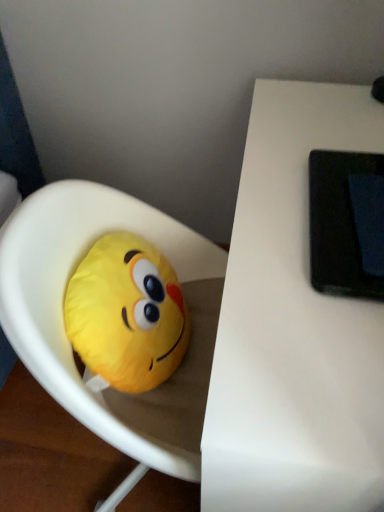
Question: From a real-world perspective, is yellow fabric emoji pillow at left, marked as the 2th toy in a left-to-right arrangement, below yellow plush toy at left, the 2th toy from the right?

Choices:
 (A) no
 (B) yes

Answer: (B)

Question: Does yellow fabric emoji pillow at left, marked as the 2th toy in a left-to-right arrangement, have a smaller size compared to yellow plush toy at left, the 2th toy from the right?

Choices:
 (A) no
 (B) yes

Answer: (A)

Question: Could you tell me if yellow fabric emoji pillow at left, marked as the 2th toy in a left-to-right arrangement, is facing yellow plush toy at left, placed as the 1th toy when sorted from left to right?

Choices:
 (A) no
 (B) yes

Answer: (B)

Question: From the image's perspective, does yellow fabric emoji pillow at left, arranged as the first toy when viewed from the right, appear higher than yellow plush toy at left, the 2th toy from the right?

Choices:
 (A) yes
 (B) no

Answer: (B)

Question: Would you say yellow fabric emoji pillow at left, marked as the 2th toy in a left-to-right arrangement, is outside yellow plush toy at left, the 2th toy from the right?

Choices:
 (A) yes
 (B) no

Answer: (A)

Question: Considering the positions of yellow plush toy at left, placed as the 1th toy when sorted from left to right, and white matte table at upper right in the image, is yellow plush toy at left, placed as the 1th toy when sorted from left to right, taller or shorter than white matte table at upper right?

Choices:
 (A) tall
 (B) short

Answer: (B)

Question: From the image's perspective, is yellow plush toy at left, placed as the 1th toy when sorted from left to right, positioned above or below white matte table at upper right?

Choices:
 (A) above
 (B) below

Answer: (A)

Question: Considering the relative positions of yellow plush toy at left, the 2th toy from the right, and white matte table at upper right in the image provided, is yellow plush toy at left, the 2th toy from the right, to the left or to the right of white matte table at upper right?

Choices:
 (A) left
 (B) right

Answer: (A)

Question: Is yellow plush toy at left, the 2th toy from the right, situated inside white matte table at upper right or outside?

Choices:
 (A) inside
 (B) outside

Answer: (B)

Question: Considering the positions of yellow plush toy at left, the 2th toy from the right, and yellow fabric emoji pillow at left, marked as the 2th toy in a left-to-right arrangement, in the image, is yellow plush toy at left, the 2th toy from the right, bigger or smaller than yellow fabric emoji pillow at left, marked as the 2th toy in a left-to-right arrangement,?

Choices:
 (A) big
 (B) small

Answer: (B)

Question: In the image, is yellow plush toy at left, the 2th toy from the right, on the left side or the right side of yellow fabric emoji pillow at left, marked as the 2th toy in a left-to-right arrangement?

Choices:
 (A) right
 (B) left

Answer: (B)

Question: From a real-world perspective, is yellow plush toy at left, placed as the 1th toy when sorted from left to right, above or below yellow fabric emoji pillow at left, marked as the 2th toy in a left-to-right arrangement?

Choices:
 (A) above
 (B) below

Answer: (A)

Question: In terms of height, does yellow plush toy at left, the 2th toy from the right, look taller or shorter compared to yellow fabric emoji pillow at left, marked as the 2th toy in a left-to-right arrangement?

Choices:
 (A) short
 (B) tall

Answer: (A)

Question: Based on their sizes in the image, would you say yellow fabric emoji pillow at left, arranged as the first toy when viewed from the right, is bigger or smaller than yellow plush toy at left, the 2th toy from the right?

Choices:
 (A) big
 (B) small

Answer: (A)

Question: Looking at their shapes, would you say yellow fabric emoji pillow at left, arranged as the first toy when viewed from the right, is wider or thinner than yellow plush toy at left, the 2th toy from the right?

Choices:
 (A) wide
 (B) thin

Answer: (A)